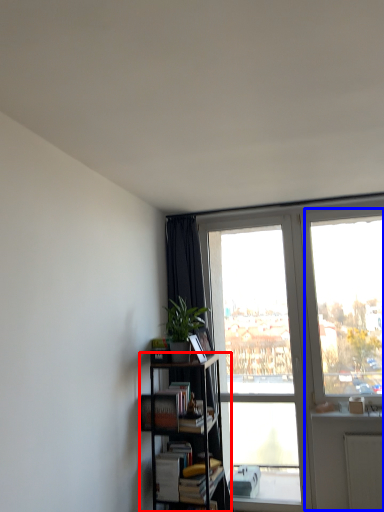
Question: Which object is further to the camera taking this photo, bookcase (highlighted by a red box) or glass door (highlighted by a blue box)?

Choices:
 (A) bookcase
 (B) glass door

Answer: (B)